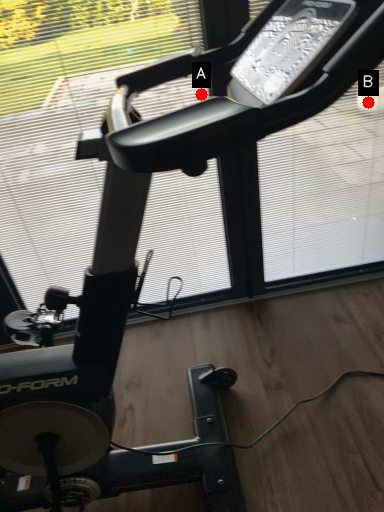
Question: Two points are circled on the image, labeled by A and B beside each circle. Which point appears farthest from the camera in this image?

Choices:
 (A) A is further
 (B) B is further

Answer: (B)